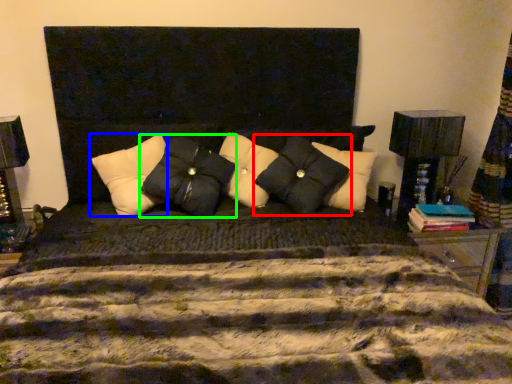
Question: Which is farther away from pillow (highlighted by a red box)? pillow (highlighted by a blue box) or pillow (highlighted by a green box)?

Choices:
 (A) pillow
 (B) pillow

Answer: (A)